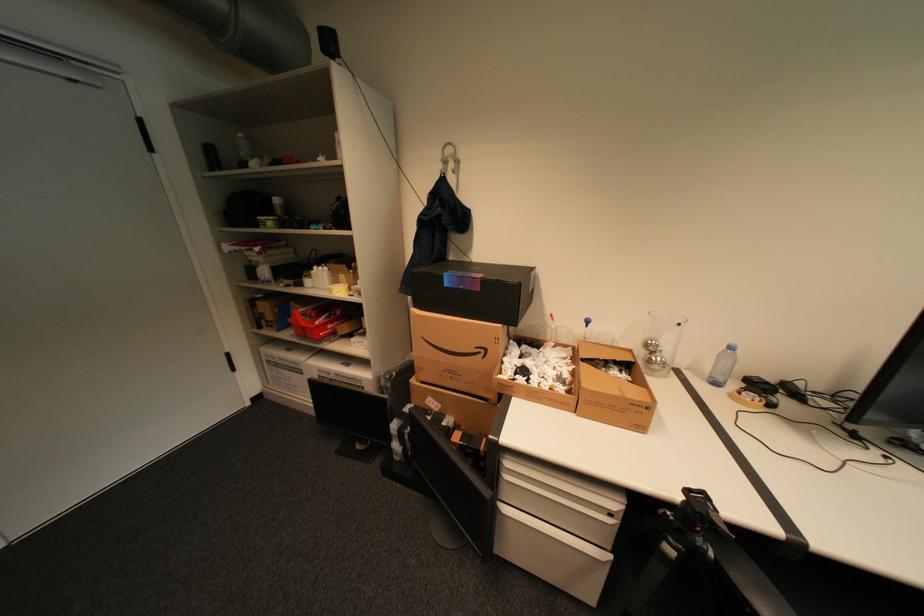
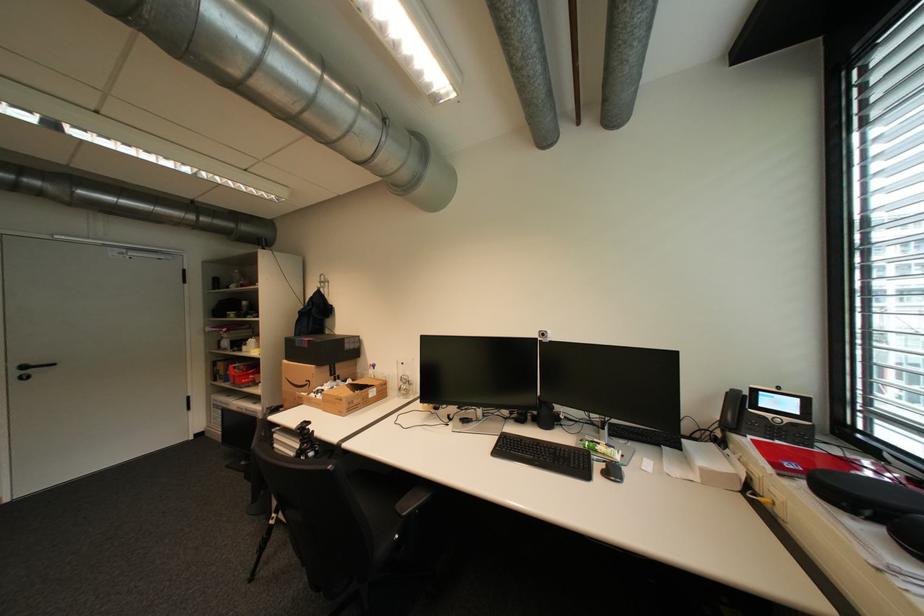
Locate, in the second image, the point that corresponds to [492,352] in the first image.

(317, 383)